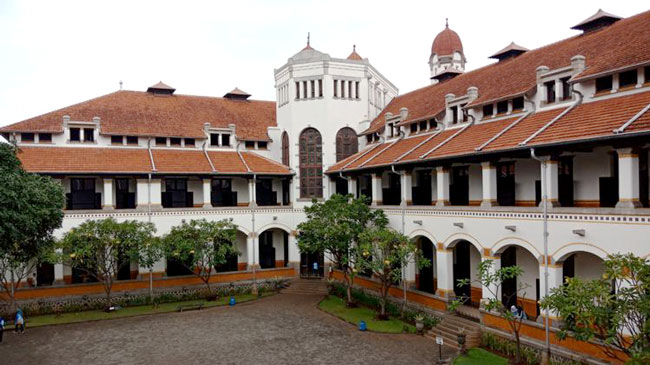
I want to click on stained glass, so click(x=312, y=147).